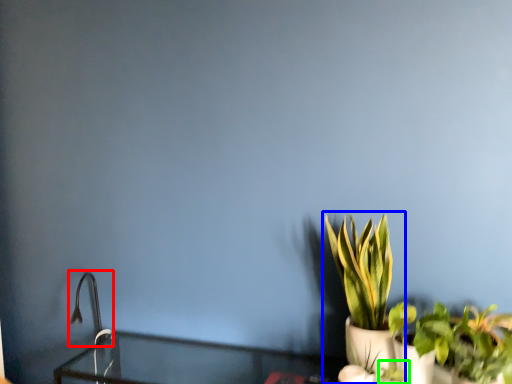
Question: Estimate the real-world distances between objects in this image. Which object is closer to faucet (highlighted by a red box), houseplant (highlighted by a blue box) or plant (highlighted by a green box)?

Choices:
 (A) houseplant
 (B) plant

Answer: (A)